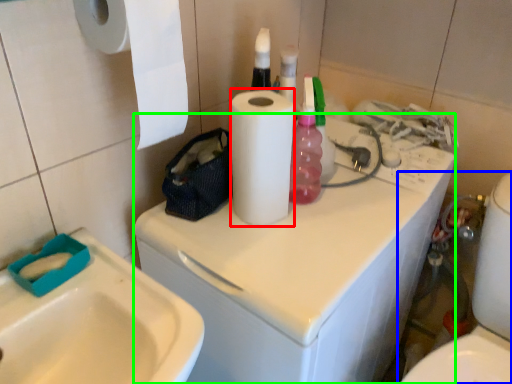
Question: Which is nearer to the paper towel (highlighted by a red box)? toilet (highlighted by a blue box) or washing machine (highlighted by a green box).

Choices:
 (A) toilet
 (B) washing machine

Answer: (B)